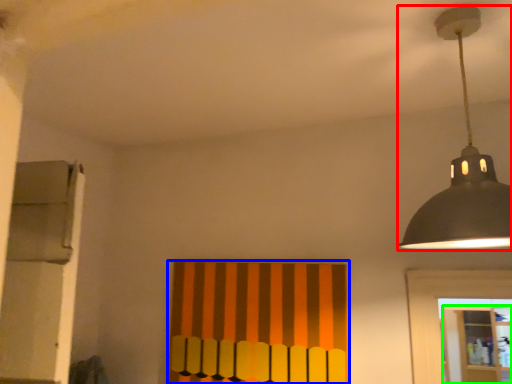
Question: Which object is the farthest from lamp (highlighted by a red box)? Choose among these: curtain (highlighted by a blue box) or shelf (highlighted by a green box).

Choices:
 (A) curtain
 (B) shelf

Answer: (B)